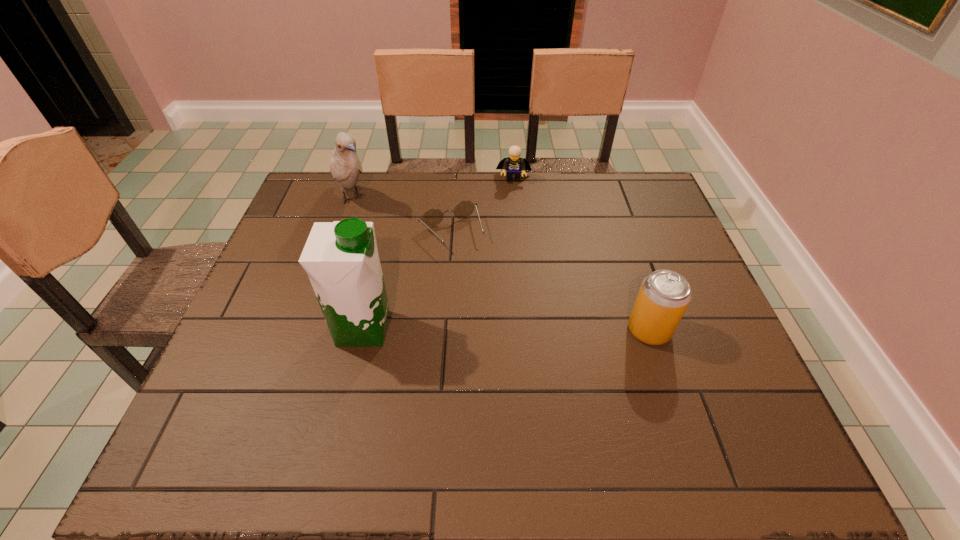
Identify the location of vacant space located 0.170m on the front-facing side of the shortest object. [490, 295].

Find the location of a particular element. The image size is (960, 540). vacant space situated 0.200m on the front-facing side of the shortest object is located at coordinates (494, 303).

The image size is (960, 540). I want to click on vacant point located 0.130m on the front-facing side of the shortest object, so click(x=483, y=284).

Identify the location of vacant space located 0.180m at the beak of the bird. This screenshot has width=960, height=540. (393, 244).

Find the location of a particular element. The image size is (960, 540). free space located 0.290m at the beak of the bird is located at coordinates (414, 265).

The height and width of the screenshot is (540, 960). In order to click on free point located at the beak of the bird in this screenshot , I will do `click(399, 251)`.

Identify the location of vacant region located 0.090m on the front-facing side of the Lego. (513, 201).

Where is `vacant space situated on the front-facing side of the Lego`? vacant space situated on the front-facing side of the Lego is located at coordinates (512, 224).

The height and width of the screenshot is (540, 960). In order to click on free point located on the front-facing side of the Lego in this screenshot , I will do `click(513, 194)`.

Identify the location of spectacles at the far edge. This screenshot has width=960, height=540. (433, 217).